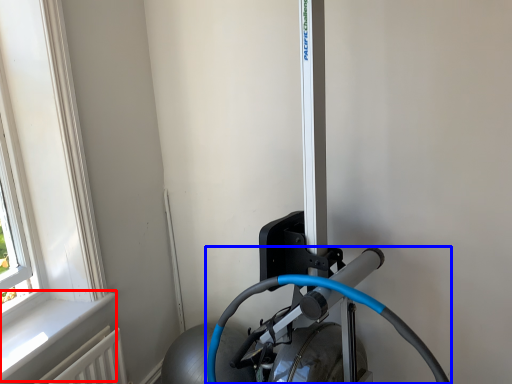
Question: Which object is further to the camera taking this photo, window sill (highlighted by a red box) or sport equipment (highlighted by a blue box)?

Choices:
 (A) window sill
 (B) sport equipment

Answer: (A)